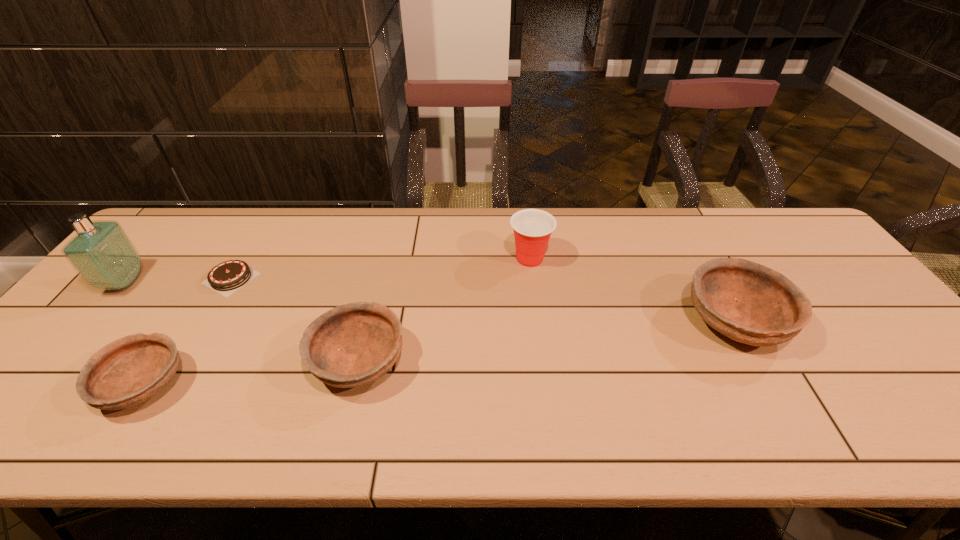
In the image, there is a desktop. Where is `vacant space at the right edge`? vacant space at the right edge is located at coordinates (785, 269).

This screenshot has width=960, height=540. What are the coordinates of `vacant position at the far left corner of the desktop` in the screenshot? It's located at (197, 226).

Image resolution: width=960 pixels, height=540 pixels. I want to click on free space at the near left corner of the desktop, so click(57, 384).

At what (x,y) coordinates should I click in order to perform the action: click on free area in between the shortest object and the shortest bowl. Please return your answer as a coordinate pair (x, y). The image size is (960, 540). Looking at the image, I should click on (187, 332).

Find the location of `empty location between the chocolate cake and the perfume`. empty location between the chocolate cake and the perfume is located at coordinates 178,280.

What are the coordinates of `free space between the third shortest object and the second shortest object` in the screenshot? It's located at (252, 374).

Where is `vacant space that is in between the second tallest bowl and the second shortest object`? vacant space that is in between the second tallest bowl and the second shortest object is located at coordinates (252, 374).

Locate an element on the screen. free space between the second bowl from right to left and the shortest bowl is located at coordinates (252, 374).

The height and width of the screenshot is (540, 960). What are the coordinates of `free spot between the shortest object and the tallest object` in the screenshot? It's located at (178, 280).

Where is `empty space between the tallest object and the cup`? empty space between the tallest object and the cup is located at coordinates (327, 271).